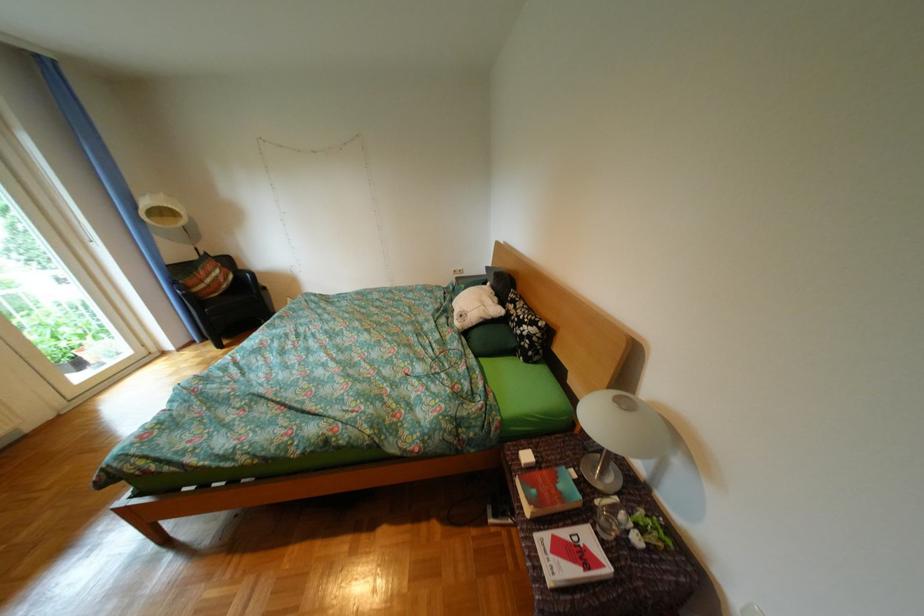
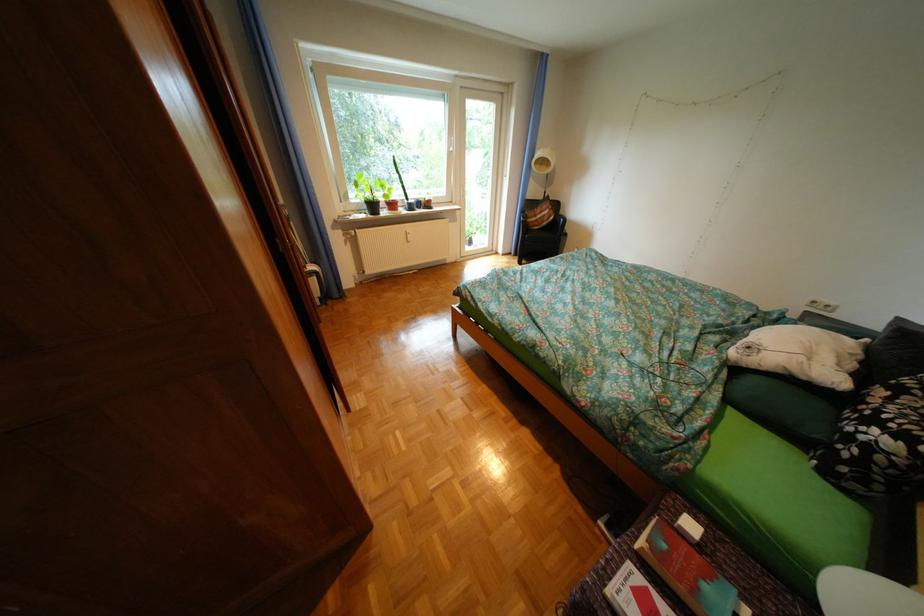
The point at (568, 560) is marked in the first image. Where is the corresponding point in the second image?

(642, 592)